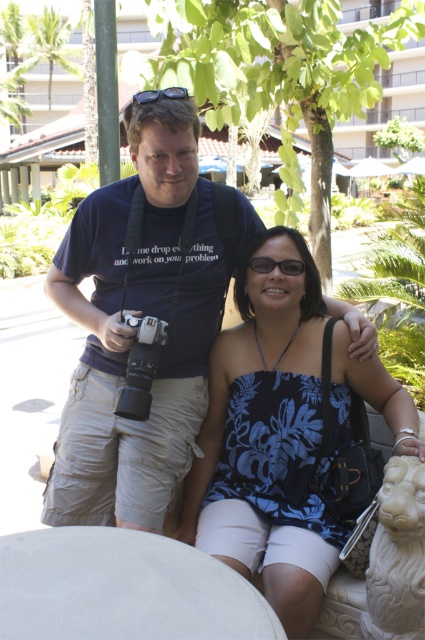
Is point (198, 120) farther from camera compared to point (249, 252)?

That is False.

Is the position of matte blue shirt at center less distant than that of blue floral tank top at center?

No, matte blue shirt at center is behind blue floral tank top at center.

Which is behind, point (176, 321) or point (266, 369)?

The point (266, 369) is more distant.

Locate an element on the screen. Image resolution: width=425 pixels, height=640 pixels. matte blue shirt at center is located at coordinates (133, 330).

Can you confirm if matte blue shirt at center is shorter than silver metallic camera at center?

No.

Who is more distant from viewer, (249, 230) or (138, 360)?

The point (249, 230) is more distant.

Which is behind, point (210, 314) or point (144, 336)?

Positioned behind is point (210, 314).

Locate an element on the screen. The image size is (425, 640). matte blue shirt at center is located at coordinates (133, 330).

Consider the image. Is blue floral tank top at center below silver metallic camera at center?

Yes, blue floral tank top at center is below silver metallic camera at center.

Is blue floral tank top at center to the left of silver metallic camera at center from the viewer's perspective?

Incorrect, blue floral tank top at center is not on the left side of silver metallic camera at center.

Find the location of a particular element. Image resolution: width=425 pixels, height=640 pixels. blue floral tank top at center is located at coordinates (268, 435).